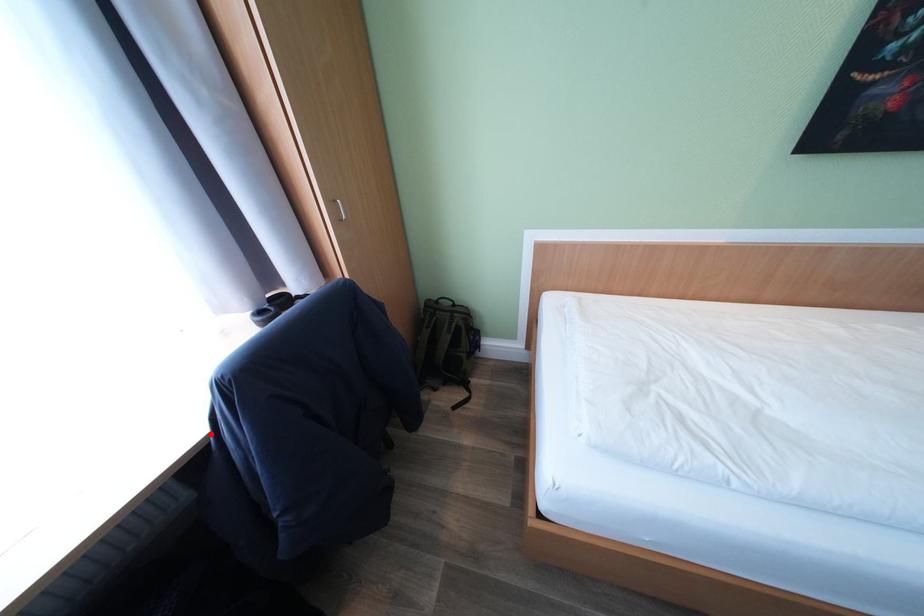
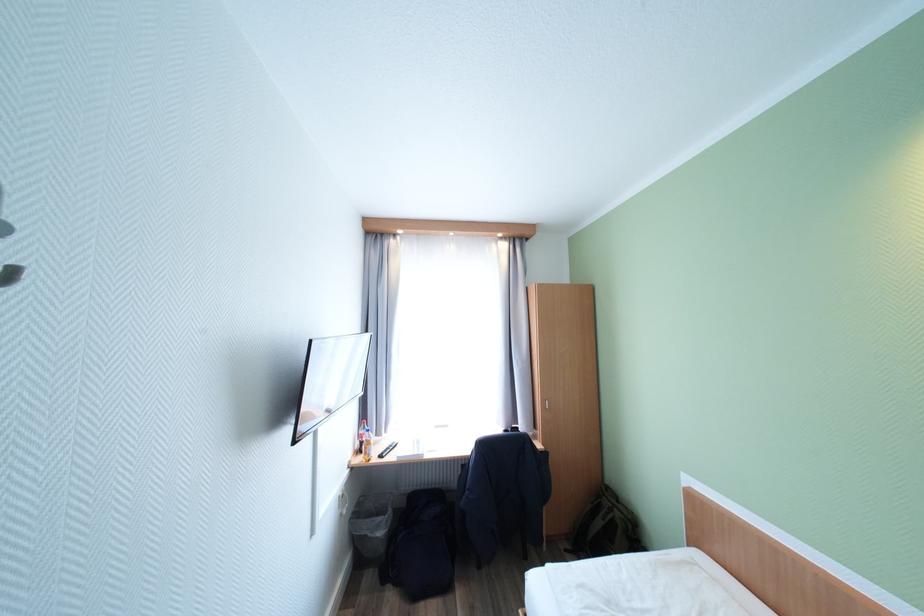
Find the pixel in the second image that matches the highlighted location in the first image.

(477, 455)